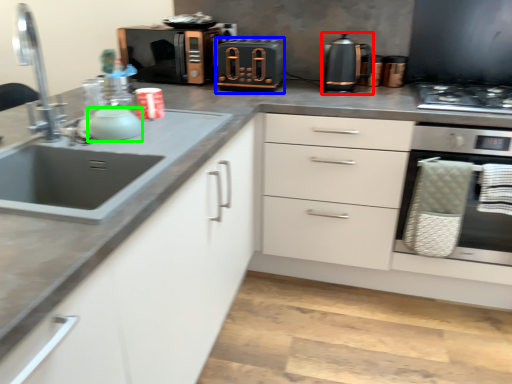
Question: Which object is the farthest from kitchen appliance (highlighted by a red box)? Choose among these: appliance (highlighted by a blue box) or appliance (highlighted by a green box).

Choices:
 (A) appliance
 (B) appliance

Answer: (B)